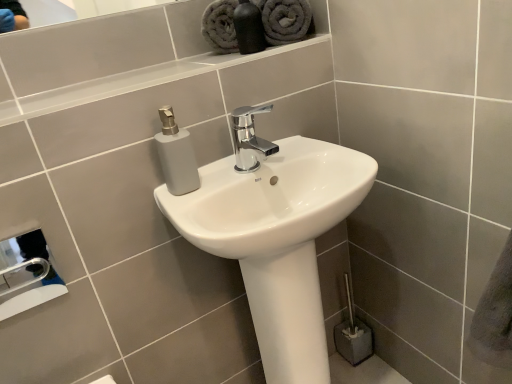
Question: Does matte black bottle at upper center turn towards white glossy sink at center?

Choices:
 (A) yes
 (B) no

Answer: (B)

Question: Considering the relative sizes of matte black bottle at upper center and white glossy sink at center in the image provided, is matte black bottle at upper center taller than white glossy sink at center?

Choices:
 (A) no
 (B) yes

Answer: (A)

Question: Considering the relative positions of matte black bottle at upper center and white glossy sink at center in the image provided, is matte black bottle at upper center behind white glossy sink at center?

Choices:
 (A) yes
 (B) no

Answer: (A)

Question: From the image's perspective, is matte black bottle at upper center beneath white glossy sink at center?

Choices:
 (A) yes
 (B) no

Answer: (B)

Question: Is matte black bottle at upper center far away from white glossy sink at center?

Choices:
 (A) yes
 (B) no

Answer: (B)

Question: From a real-world perspective, is white glossy sink at center physically located above or below gray plush towel at upper center, which is the 1th bath towel from left to right?

Choices:
 (A) below
 (B) above

Answer: (A)

Question: Based on their positions, is white glossy sink at center located to the left or right of gray plush towel at upper center, which is the 1th bath towel from left to right?

Choices:
 (A) right
 (B) left

Answer: (A)

Question: Is white glossy sink at center spatially inside gray plush towel at upper center, the 2th bath towel positioned from the right, or outside of it?

Choices:
 (A) inside
 (B) outside

Answer: (B)

Question: From the image's perspective, is white glossy sink at center positioned above or below gray plush towel at upper center, which is the 1th bath towel from left to right?

Choices:
 (A) above
 (B) below

Answer: (B)

Question: Relative to metallic silver hand dryer at lower left, is matte black bottle at upper center in front or behind?

Choices:
 (A) front
 (B) behind

Answer: (B)

Question: Considering the relative positions of matte black bottle at upper center and metallic silver hand dryer at lower left in the image provided, is matte black bottle at upper center to the left or to the right of metallic silver hand dryer at lower left?

Choices:
 (A) left
 (B) right

Answer: (B)

Question: From a real-world perspective, relative to metallic silver hand dryer at lower left, is matte black bottle at upper center vertically above or below?

Choices:
 (A) below
 (B) above

Answer: (B)

Question: From their relative heights in the image, would you say matte black bottle at upper center is taller or shorter than metallic silver hand dryer at lower left?

Choices:
 (A) tall
 (B) short

Answer: (A)

Question: Is metallic silver hand dryer at lower left bigger or smaller than gray plush towel at upper center, the 2th bath towel positioned from the right?

Choices:
 (A) small
 (B) big

Answer: (A)

Question: Is point (12, 279) positioned closer to the camera than point (215, 11)?

Choices:
 (A) closer
 (B) farther

Answer: (B)